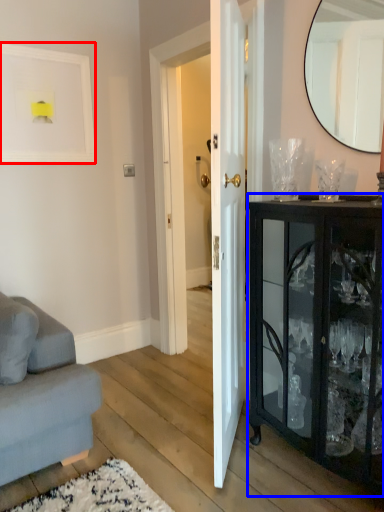
Question: Which object appears closest to the camera in this image, picture frame (highlighted by a red box) or cabinetry (highlighted by a blue box)?

Choices:
 (A) picture frame
 (B) cabinetry

Answer: (B)